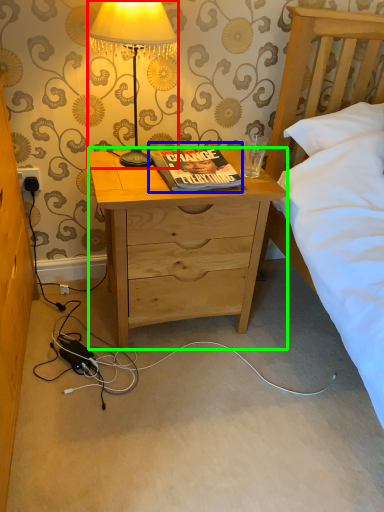
Question: Which is nearer to the lamp (highlighted by a red box)? book (highlighted by a blue box) or desk (highlighted by a green box).

Choices:
 (A) book
 (B) desk

Answer: (A)